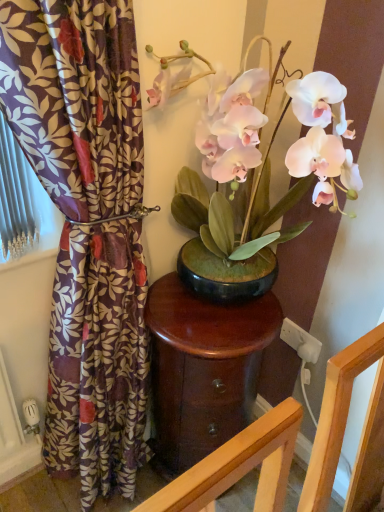
Question: From the image's perspective, is white matte orchid at center below purple floral fabric at left?

Choices:
 (A) no
 (B) yes

Answer: (A)

Question: From the image's perspective, does white matte orchid at center appear higher than purple floral fabric at left?

Choices:
 (A) yes
 (B) no

Answer: (A)

Question: Considering the relative sizes of white matte orchid at center and purple floral fabric at left in the image provided, is white matte orchid at center wider than purple floral fabric at left?

Choices:
 (A) no
 (B) yes

Answer: (B)

Question: Can purple floral fabric at left be found inside white matte orchid at center?

Choices:
 (A) yes
 (B) no

Answer: (B)

Question: Is purple floral fabric at left at the back of white matte orchid at center?

Choices:
 (A) yes
 (B) no

Answer: (B)

Question: From the image's perspective, is glossy wood table at center positioned above or below purple floral fabric at left?

Choices:
 (A) above
 (B) below

Answer: (B)

Question: Does point (172, 358) appear closer or farther from the camera than point (91, 385)?

Choices:
 (A) closer
 (B) farther

Answer: (A)

Question: Is glossy wood table at center taller or shorter than purple floral fabric at left?

Choices:
 (A) tall
 (B) short

Answer: (B)

Question: Would you say glossy wood table at center is inside or outside purple floral fabric at left?

Choices:
 (A) inside
 (B) outside

Answer: (B)

Question: From the image's perspective, is white matte orchid at center located above or below purple floral fabric at left?

Choices:
 (A) below
 (B) above

Answer: (B)

Question: Considering the positions of point (337, 131) and point (120, 433), is point (337, 131) closer or farther from the camera than point (120, 433)?

Choices:
 (A) closer
 (B) farther

Answer: (A)

Question: From a real-world perspective, is white matte orchid at center above or below purple floral fabric at left?

Choices:
 (A) above
 (B) below

Answer: (A)

Question: Considering the positions of white matte orchid at center and purple floral fabric at left in the image, is white matte orchid at center wider or thinner than purple floral fabric at left?

Choices:
 (A) thin
 (B) wide

Answer: (B)

Question: Would you say purple floral fabric at left is inside or outside white matte orchid at center?

Choices:
 (A) inside
 (B) outside

Answer: (B)

Question: Visually, is purple floral fabric at left positioned to the left or to the right of white matte orchid at center?

Choices:
 (A) right
 (B) left

Answer: (B)